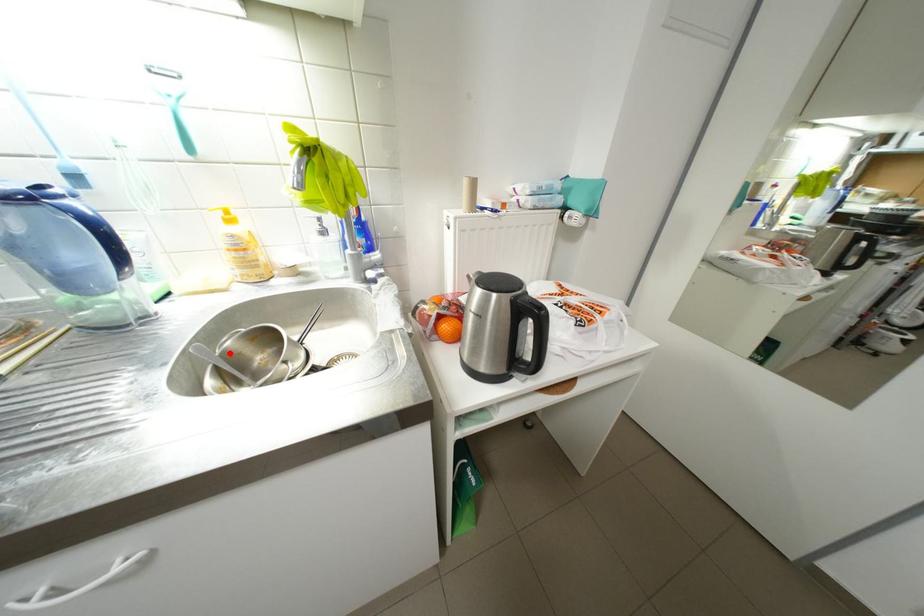
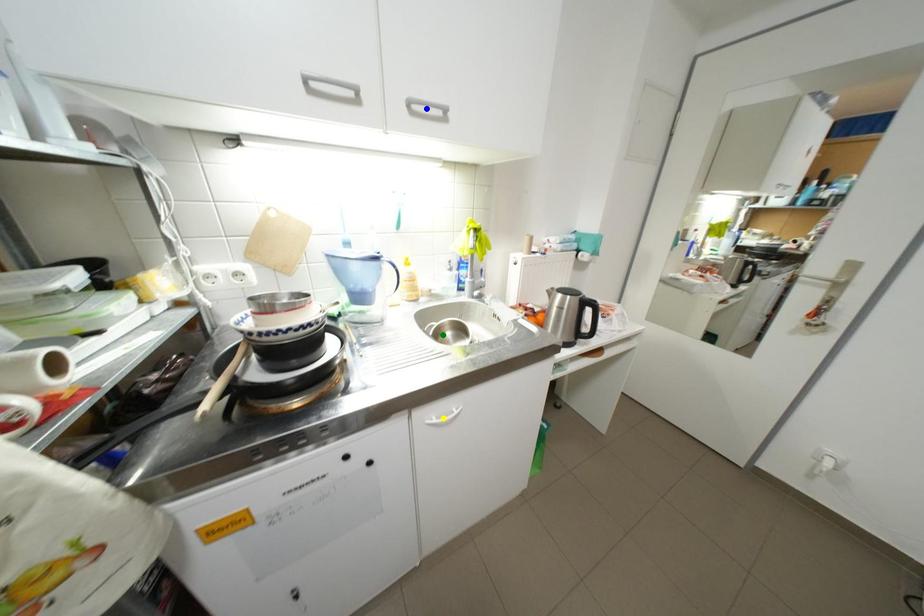
Question: I am providing you with two images of the same scene from different viewpoints. A red point is marked on the first image. You are given multiple points on the second image. Can you choose the point in image 2 that corresponds to the point in image 1?

Choices:
 (A) yellow point
 (B) green point
 (C) blue point

Answer: (B)